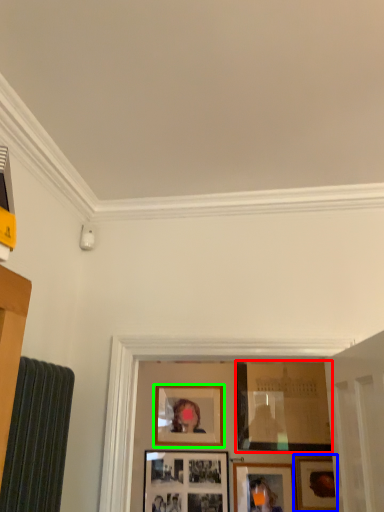
Question: Which object is the farthest from picture frame (highlighted by a red box)? Choose among these: picture frame (highlighted by a blue box) or picture frame (highlighted by a green box).

Choices:
 (A) picture frame
 (B) picture frame

Answer: (B)